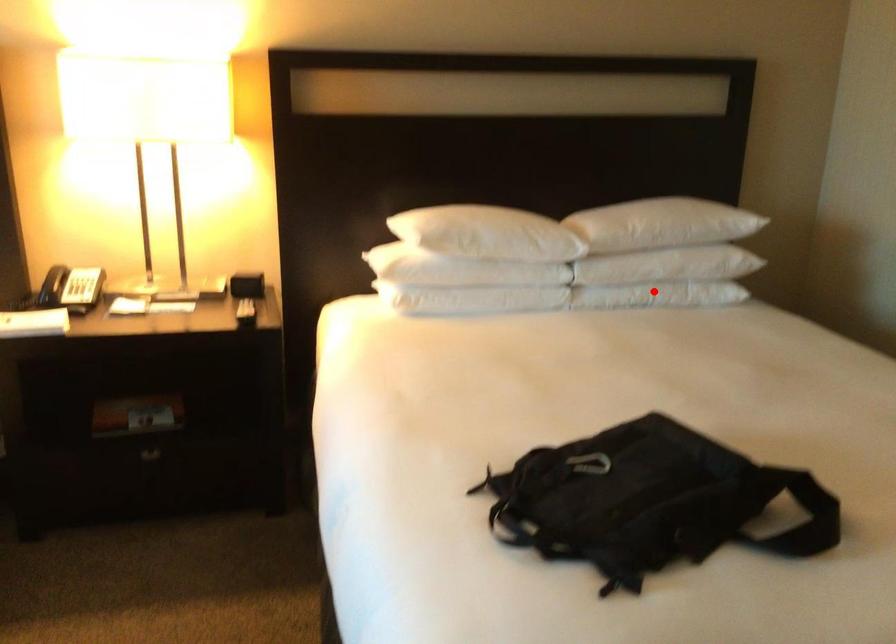
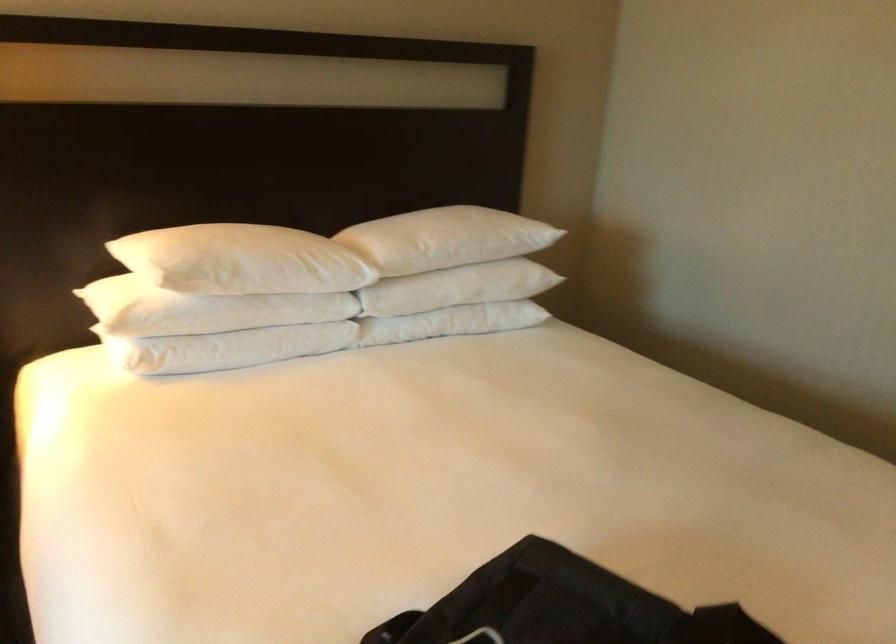
Question: I am providing you with two images of the same scene from different viewpoints. A red point is shown in image1. For the corresponding object point in image2, is it positioned nearer or farther from the camera?

Choices:
 (A) Nearer
 (B) Farther

Answer: (A)